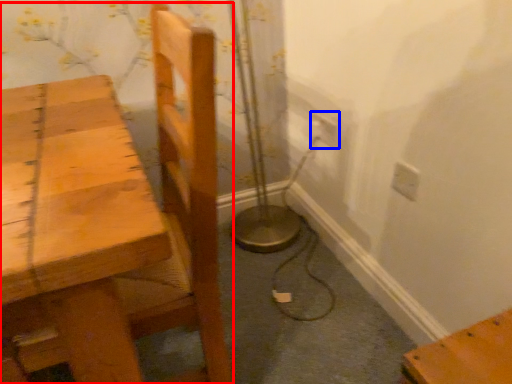
Question: Which object appears farthest to the camera in this image, chair (highlighted by a red box) or electric outlet (highlighted by a blue box)?

Choices:
 (A) chair
 (B) electric outlet

Answer: (B)